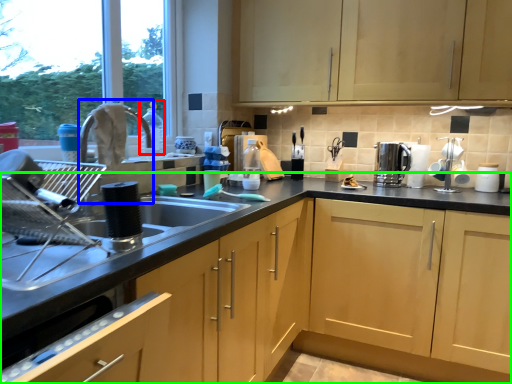
Question: Which object is positioned closest to bottle (highlighted by a red box)? Select from faucet (highlighted by a blue box) and cabinetry (highlighted by a green box).

Choices:
 (A) faucet
 (B) cabinetry

Answer: (A)